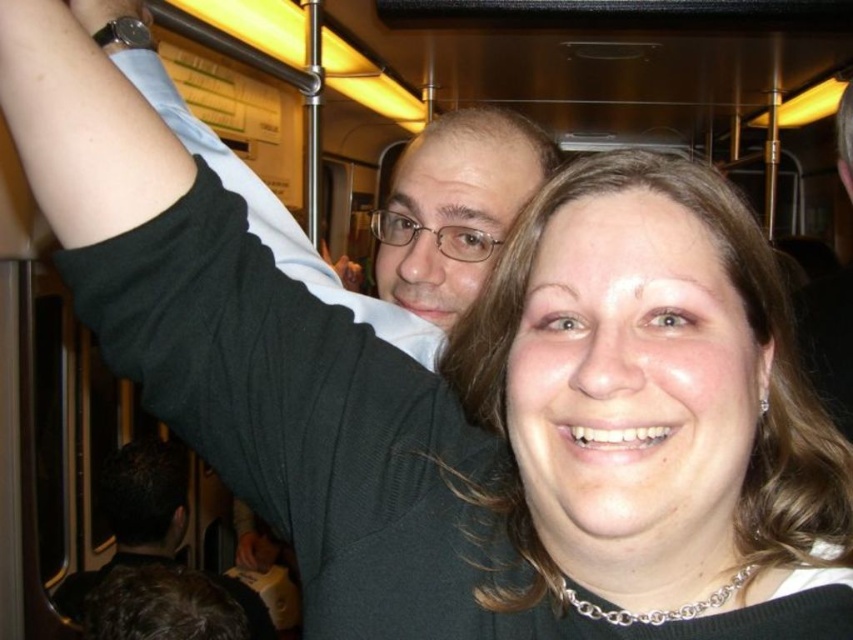
You are a photographer trying to capture a candid shot of the matte black sweater at center in a crowded train car. If your camera has a minimum focus distance of 18 inches, will you be able to take a clear photo without moving closer?

The matte black sweater at center is 17.78 inches from the camera, which is within the minimum focus distance of 18 inches. Therefore, you can take a clear photo without moving closer.

You are a passenger on a crowded train and notice two people in front of you. One is wearing a matte black sweater at center, and the other has black matte hair at upper center. Which person is standing to the right of the other?

The matte black sweater at center is positioned on the right side of black matte hair at upper center, so the person wearing the matte black sweater at center is to the right of the person with black matte hair at upper center.